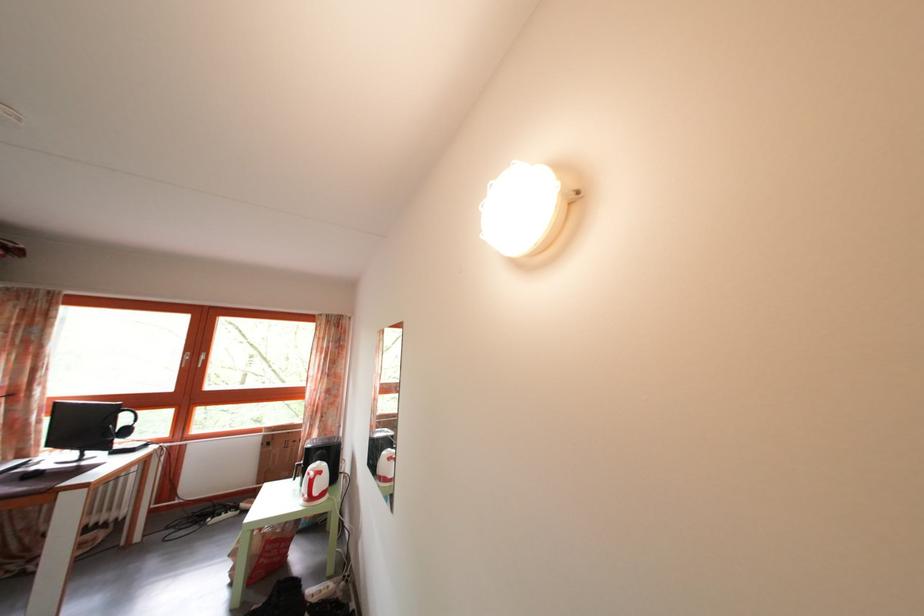
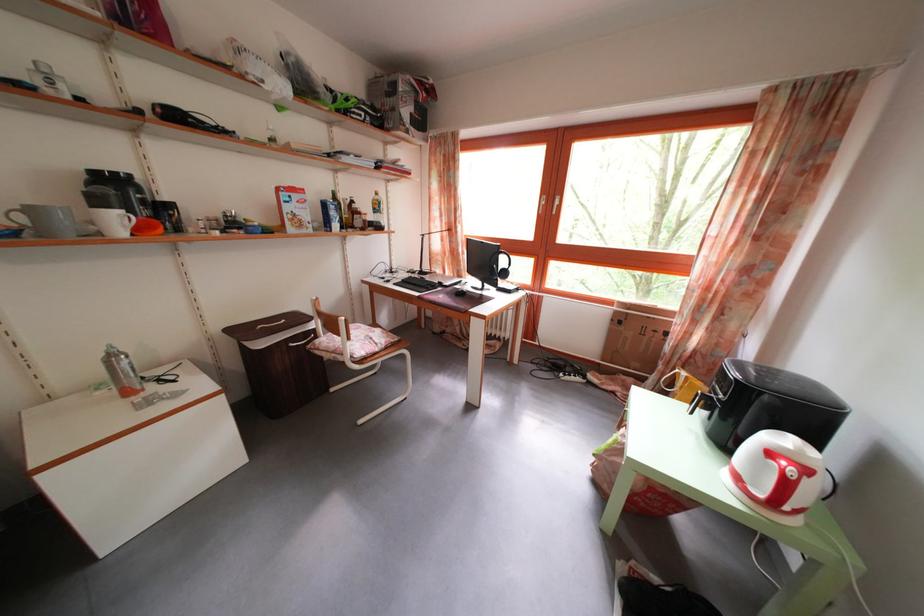
In the second image, find the point that corresponds to pixel 272 445 in the first image.

(623, 320)